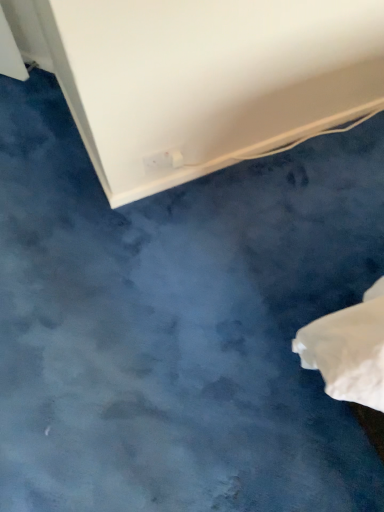
In order to face white plastic electric outlet at upper center, should I rotate leftwards or rightwards?

Rotate left and turn 3.840 degrees.

This screenshot has width=384, height=512. What do you see at coordinates (164, 160) in the screenshot? I see `white plastic electric outlet at upper center` at bounding box center [164, 160].

Where is `white plastic electric outlet at upper center`? white plastic electric outlet at upper center is located at coordinates (164, 160).

What are the coordinates of `white plastic electric outlet at upper center` in the screenshot? It's located at (164, 160).